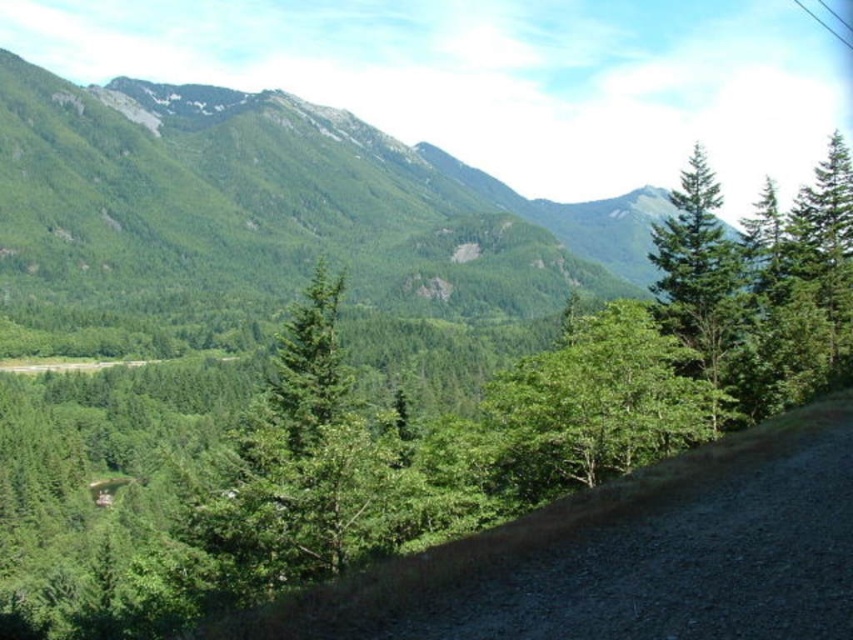
You are standing at the starting point of the gravel road in the image. Looking towards the upper center, there is a point marked at coordinates (x=274, y=202). What does this point represent in the scene?

The point at (x=274, y=202) represents a green forested mountain at upper center.

From the picture: You are a hiker planning to take a photo of the green forested mountain at upper center and the green matte tree at upper right. Which object should you focus on first to ensure both are in the frame?

You should focus on the green forested mountain at upper center first because it is closer to you than the green matte tree at upper right, so it will appear larger in the frame and help frame the composition.